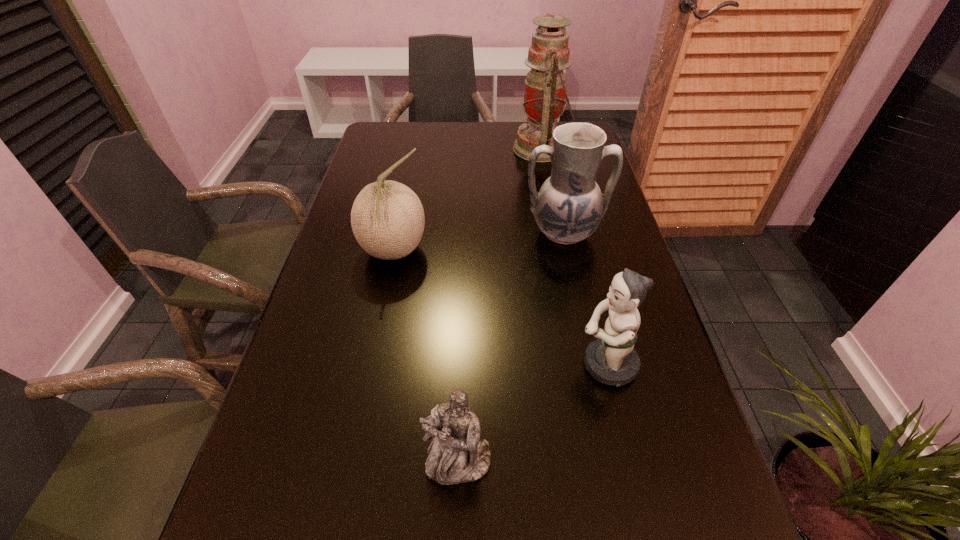
Where is `object situated at the far right corner`? object situated at the far right corner is located at coordinates click(x=545, y=91).

This screenshot has width=960, height=540. Identify the location of free region at the far edge of the desktop. (502, 136).

This screenshot has height=540, width=960. What are the coordinates of `vacant region at the left edge of the desktop` in the screenshot? It's located at (373, 159).

Locate an element on the screen. free point at the right edge is located at coordinates (660, 431).

Image resolution: width=960 pixels, height=540 pixels. In the image, there is a desktop. Identify the location of vacant space at the far left corner. click(x=380, y=125).

You are a GUI agent. You are given a task and a screenshot of the screen. Output one action in this format:
    pyautogui.click(x=<x>, y=<y>)
    Task: Click on the unoccupied position between the farther figurine and the tallest object
    The height and width of the screenshot is (540, 960).
    Given the screenshot: What is the action you would take?
    pyautogui.click(x=574, y=256)

This screenshot has height=540, width=960. Find the location of `vacant area that lies between the oil lamp and the taller figurine`. vacant area that lies between the oil lamp and the taller figurine is located at coordinates (574, 256).

At what (x,y) coordinates should I click in order to perform the action: click on vacant area between the farther figurine and the left figurine. Please return your answer as a coordinate pair (x, y). Image resolution: width=960 pixels, height=540 pixels. Looking at the image, I should click on (532, 414).

This screenshot has height=540, width=960. I want to click on blank region between the cantaloup and the left figurine, so click(426, 357).

This screenshot has width=960, height=540. What are the coordinates of `vacant space that is in between the oil lamp and the taller figurine` in the screenshot? It's located at (574, 256).